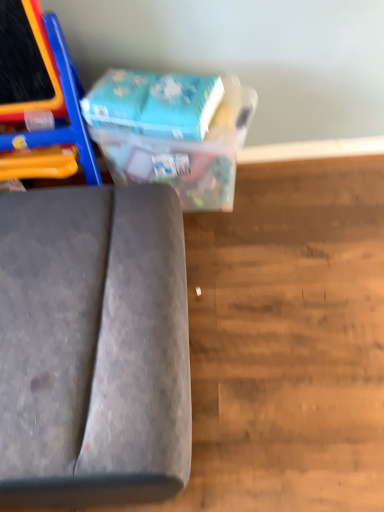
Where is `vacant space to the right of blue cardboard box at upper center`? The width and height of the screenshot is (384, 512). vacant space to the right of blue cardboard box at upper center is located at coordinates (302, 211).